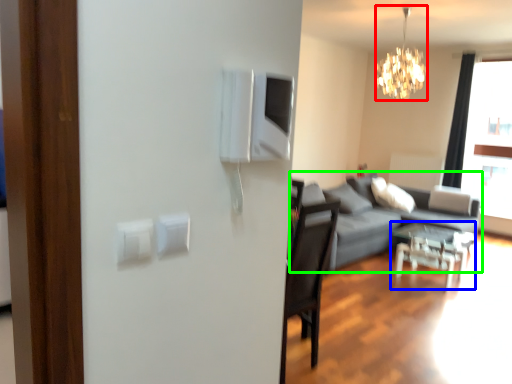
Question: Based on their relative distances, which object is farther from lamp (highlighted by a red box)? Choose from table (highlighted by a blue box) and studio couch (highlighted by a green box).

Choices:
 (A) table
 (B) studio couch

Answer: (A)